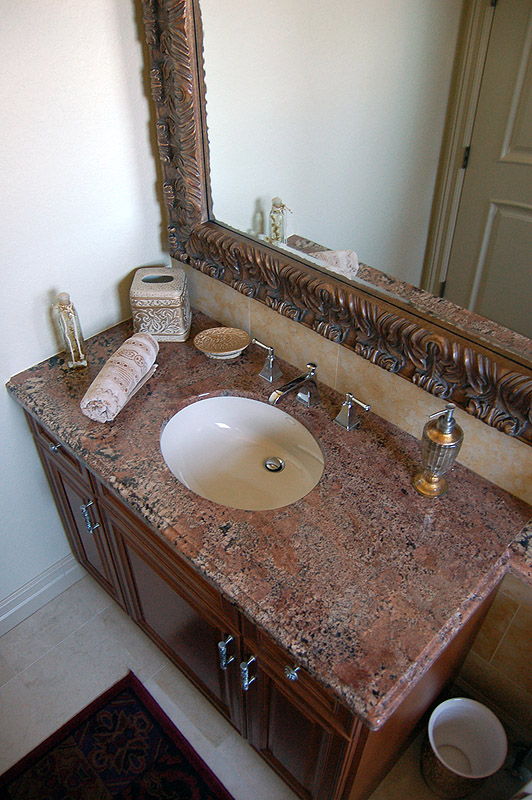
The image size is (532, 800). I want to click on decorative throw rug, so click(156, 756).